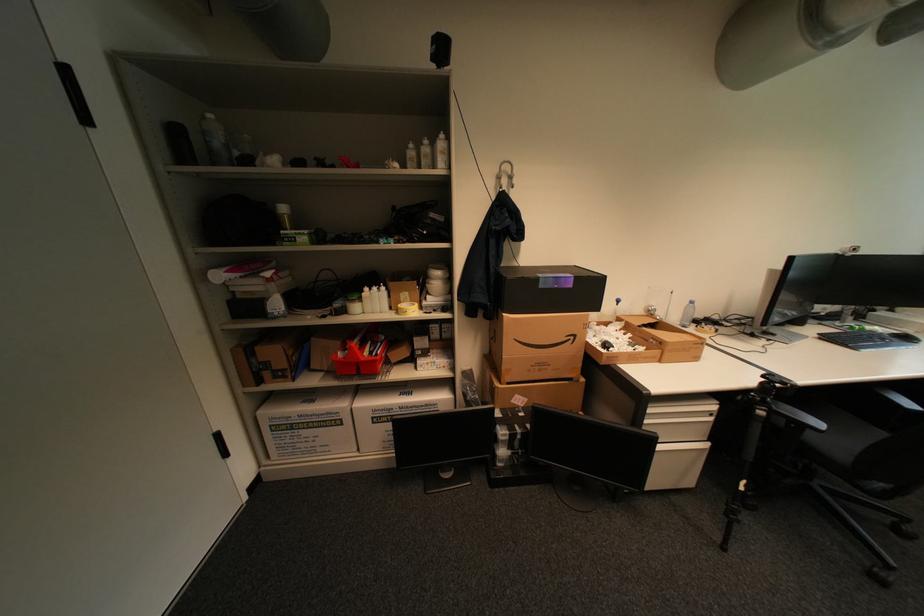
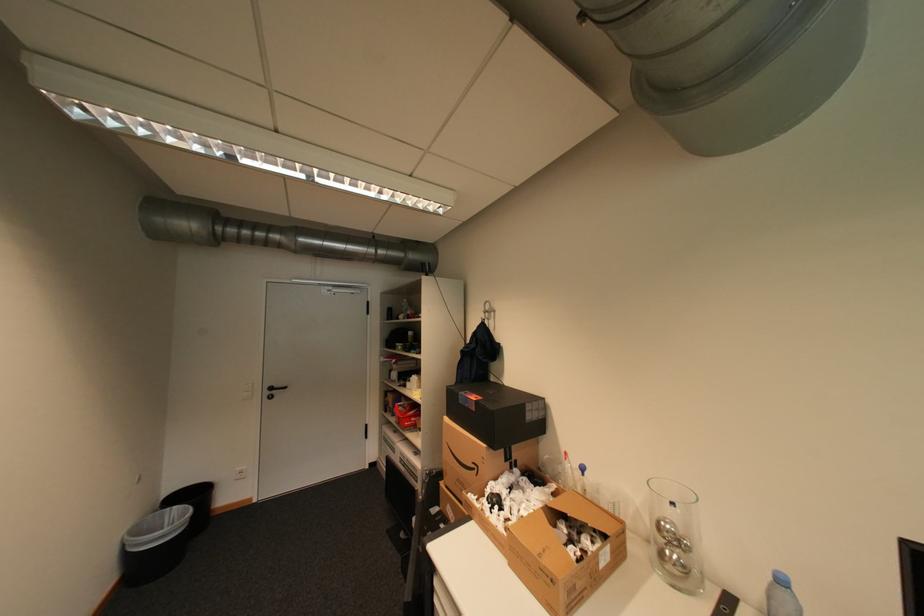
Locate, in the second image, the point that corresponds to point 301,381 in the first image.

(400, 416)